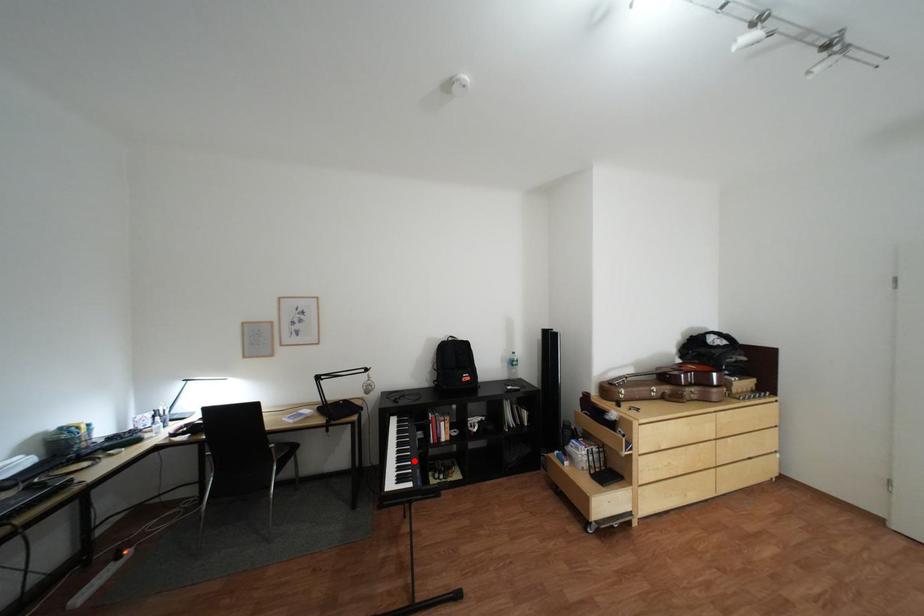
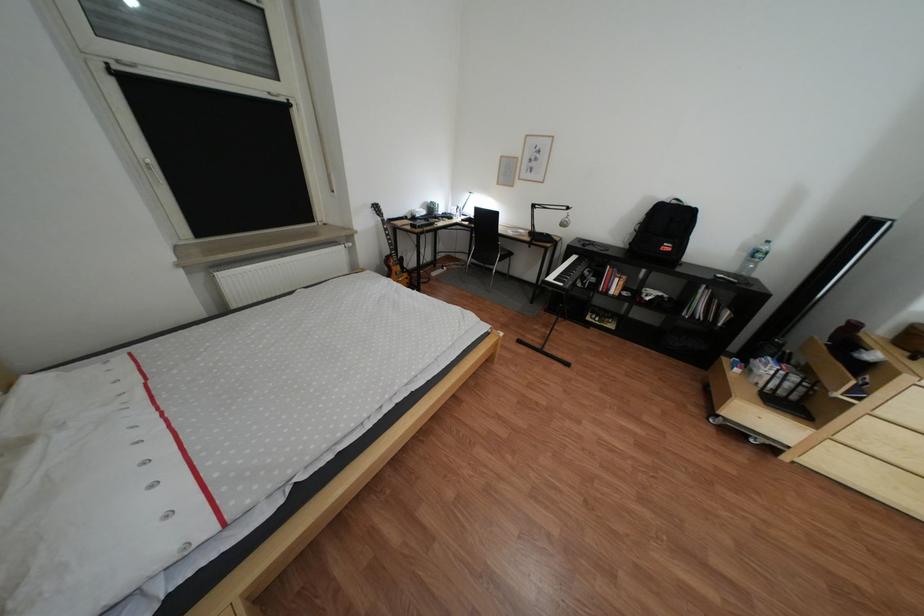
Question: I am providing you with two images of the same scene from different viewpoints. In image1, a red point is highlighted. Considering the same 3D point in image2, which of the following is correct?

Choices:
 (A) It is closer
 (B) It is farther

Answer: (B)